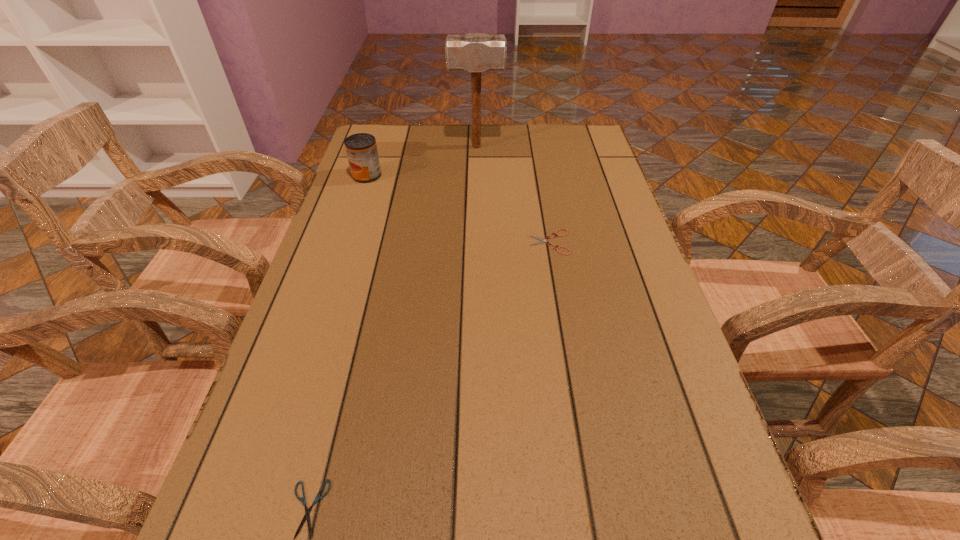
Identify the location of mallet. coord(476,52).

The width and height of the screenshot is (960, 540). Find the location of `the tallest object`. the tallest object is located at coordinates (476, 52).

The width and height of the screenshot is (960, 540). In order to click on can in this screenshot , I will do `click(361, 148)`.

You are a GUI agent. You are given a task and a screenshot of the screen. Output one action in this format:
    pyautogui.click(x=<x>, y=<y>)
    Task: Click on the second farthest object
    
    Given the screenshot: What is the action you would take?
    pyautogui.click(x=361, y=148)

Find the location of a particular element. Image resolution: width=960 pixels, height=540 pixels. the right shears is located at coordinates (543, 240).

You are a GUI agent. You are given a task and a screenshot of the screen. Output one action in this format:
    pyautogui.click(x=<x>, y=<y>)
    Task: Click on the second shortest object
    The width and height of the screenshot is (960, 540).
    Given the screenshot: What is the action you would take?
    pyautogui.click(x=543, y=240)

The width and height of the screenshot is (960, 540). In order to click on vacant space located 0.090m on the striking face of the mallet in this screenshot , I will do `click(532, 147)`.

In order to click on vacant space located on the right of the can in this screenshot , I will do `click(438, 176)`.

Where is `free region located 0.180m on the front of the third farthest object`? The image size is (960, 540). free region located 0.180m on the front of the third farthest object is located at coordinates (563, 315).

Where is `object present at the far edge`? object present at the far edge is located at coordinates (476, 52).